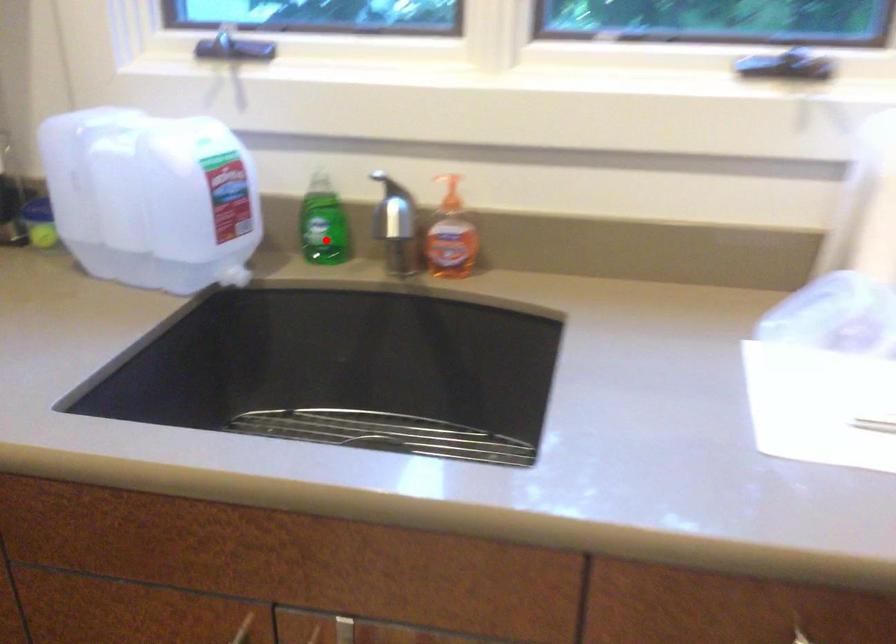
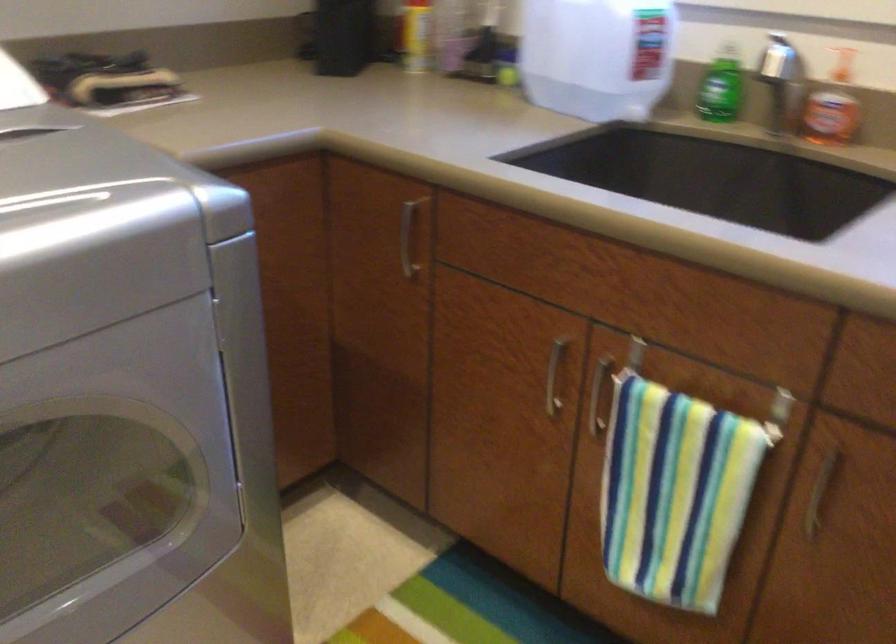
Question: A red point is marked in image1. In image2, is the corresponding 3D point closer to the camera or farther? Reply with the corresponding letter.

Choices:
 (A) The corresponding 3D point is closer.
 (B) The corresponding 3D point is farther.

Answer: (B)